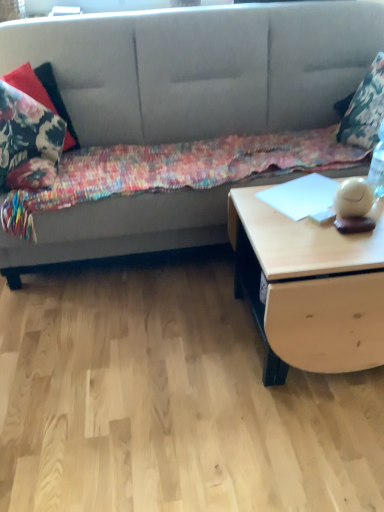
Question: Does light wood/texture table at right lie behind floral fabric pillow at upper right, the 2th pillow positioned from the left?

Choices:
 (A) no
 (B) yes

Answer: (A)

Question: From a real-world perspective, is light wood/texture table at right located higher than floral fabric pillow at upper right, placed as the 1th pillow when sorted from right to left?

Choices:
 (A) yes
 (B) no

Answer: (B)

Question: Does light wood/texture table at right have a larger size compared to floral fabric pillow at upper right, placed as the 1th pillow when sorted from right to left?

Choices:
 (A) yes
 (B) no

Answer: (A)

Question: Is light wood/texture table at right wider than floral fabric pillow at upper right, placed as the 1th pillow when sorted from right to left?

Choices:
 (A) yes
 (B) no

Answer: (A)

Question: Is light wood/texture table at right not near floral fabric pillow at upper right, placed as the 1th pillow when sorted from right to left?

Choices:
 (A) no
 (B) yes

Answer: (A)

Question: From the image's perspective, does light wood/texture table at right appear lower than floral fabric pillow at upper right, placed as the 1th pillow when sorted from right to left?

Choices:
 (A) yes
 (B) no

Answer: (A)

Question: Is textured gray couch at upper center smaller than floral fabric pillow at upper right, placed as the 1th pillow when sorted from right to left?

Choices:
 (A) no
 (B) yes

Answer: (A)

Question: Considering the relative sizes of textured gray couch at upper center and floral fabric pillow at upper right, placed as the 1th pillow when sorted from right to left, in the image provided, is textured gray couch at upper center wider than floral fabric pillow at upper right, placed as the 1th pillow when sorted from right to left,?

Choices:
 (A) yes
 (B) no

Answer: (A)

Question: Can you confirm if textured gray couch at upper center is positioned to the left of floral fabric pillow at upper right, placed as the 1th pillow when sorted from right to left?

Choices:
 (A) no
 (B) yes

Answer: (B)

Question: From a real-world perspective, is textured gray couch at upper center below floral fabric pillow at upper right, the 2th pillow positioned from the left?

Choices:
 (A) yes
 (B) no

Answer: (A)

Question: Is textured gray couch at upper center located outside floral fabric pillow at upper right, placed as the 1th pillow when sorted from right to left?

Choices:
 (A) yes
 (B) no

Answer: (A)

Question: Could floral fabric pillow at upper right, the 2th pillow positioned from the left, be considered to be inside textured gray couch at upper center?

Choices:
 (A) no
 (B) yes

Answer: (B)

Question: Is the surface of floral fabric pillow at upper right, placed as the 1th pillow when sorted from right to left, in direct contact with floral fabric blanket at center?

Choices:
 (A) yes
 (B) no

Answer: (B)